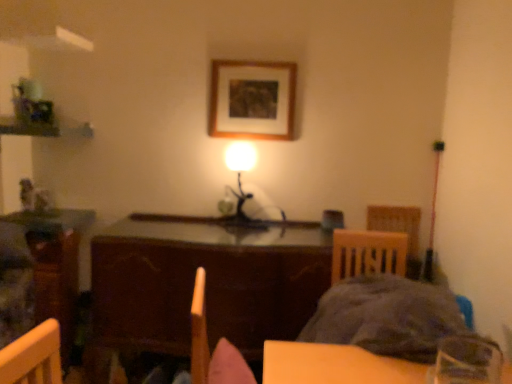
What do you see at coordinates (53, 262) in the screenshot? I see `wooden table at left, which is counted as the first table, starting from the left` at bounding box center [53, 262].

This screenshot has width=512, height=384. In order to click on wooden table at left, which is counted as the first table, starting from the left in this screenshot , I will do `click(53, 262)`.

You are a GUI agent. You are given a task and a screenshot of the screen. Output one action in this format:
    pyautogui.click(x=<x>, y=<y>)
    Task: Click on the metallic silver table lamp at center
    
    Given the screenshot: What is the action you would take?
    tap(240, 181)

What do you see at coordinates (386, 317) in the screenshot? I see `fluffy gray blanket at lower right` at bounding box center [386, 317].

Consider the image. What is the approximate width of fluffy gray blanket at lower right?

The width of fluffy gray blanket at lower right is 19.36 inches.

The image size is (512, 384). Find the location of `wooden table at left, which is counted as the first table, starting from the left`. wooden table at left, which is counted as the first table, starting from the left is located at coordinates (53, 262).

Is metallic silver table lamp at center surrounded by fluffy gray blanket at lower right?

No, metallic silver table lamp at center is not surrounded by fluffy gray blanket at lower right.

Who is shorter, fluffy gray blanket at lower right or metallic silver table lamp at center?

With less height is fluffy gray blanket at lower right.

Considering the sizes of fluffy gray blanket at lower right and metallic silver table lamp at center in the image, is fluffy gray blanket at lower right wider or thinner than metallic silver table lamp at center?

Clearly, fluffy gray blanket at lower right has more width compared to metallic silver table lamp at center.

Would you say fluffy gray blanket at lower right is to the left or to the right of metallic silver table lamp at center in the picture?

From the image, it's evident that fluffy gray blanket at lower right is to the right of metallic silver table lamp at center.

Between point (342, 228) and point (388, 326), which one is positioned in front?

Positioned in front is point (388, 326).

Consider the image. Is matte brown armchair at center facing towards fluffy gray blanket at lower right?

Yes, matte brown armchair at center is aimed at fluffy gray blanket at lower right.

Considering the relative positions of matte brown armchair at center and fluffy gray blanket at lower right in the image provided, is matte brown armchair at center to the right of fluffy gray blanket at lower right from the viewer's perspective?

In fact, matte brown armchair at center is to the left of fluffy gray blanket at lower right.

Does matte brown armchair at center have a larger size compared to fluffy gray blanket at lower right?

Actually, matte brown armchair at center might be smaller than fluffy gray blanket at lower right.

Consider the image. Could you tell me if metallic silver table lamp at center is facing wooden picture frame at upper center?

No, metallic silver table lamp at center is not aimed at wooden picture frame at upper center.

Considering the positions of point (254, 222) and point (277, 129), is point (254, 222) closer or farther from the camera than point (277, 129)?

Point (254, 222) is positioned farther from the camera compared to point (277, 129).

From a real-world perspective, between metallic silver table lamp at center and wooden picture frame at upper center, who is vertically lower?

metallic silver table lamp at center, from a real-world perspective.

Which object is thinner, metallic silver table lamp at center or wooden picture frame at upper center?

wooden picture frame at upper center is thinner.

Is metallic silver table lamp at center positioned before matte brown armchair at center?

Yes.

Can you confirm if metallic silver table lamp at center is taller than matte brown armchair at center?

Indeed, metallic silver table lamp at center has a greater height compared to matte brown armchair at center.

Is point (239, 143) in front of point (324, 212)?

That is True.

Is fluffy gray blanket at lower right positioned beyond the bounds of matte brown armchair at center?

fluffy gray blanket at lower right lies outside matte brown armchair at center's area.

From the image's perspective, which one is positioned higher, fluffy gray blanket at lower right or matte brown armchair at center?

From the image's view, matte brown armchair at center is above.

Considering the relative sizes of fluffy gray blanket at lower right and matte brown armchair at center in the image provided, is fluffy gray blanket at lower right shorter than matte brown armchair at center?

No.

Looking at this image, are fluffy gray blanket at lower right and matte brown armchair at center far apart?

No.

Looking at this image, how much distance is there between wooden picture frame at upper center and wooden table at center, which appears as the 2th table when viewed from the left?

They are 92.85 centimeters apart.

Choose the correct answer: Is wooden picture frame at upper center inside wooden table at center, which appears as the 2th table when viewed from the left, or outside it?

wooden picture frame at upper center is spatially situated outside wooden table at center, which appears as the 2th table when viewed from the left.

Could you tell me if wooden picture frame at upper center is turned towards wooden table at center, which is the first table from right to left?

No, wooden picture frame at upper center is not aimed at wooden table at center, which is the first table from right to left.

Is wooden picture frame at upper center thinner than wooden table at center, which is the first table from right to left?

Yes.

Does point (215, 332) come behind point (65, 356)?

No.

Is wooden table at center, which is the first table from right to left, looking in the opposite direction of wooden table at left, the second table viewed from the right?

No, wooden table at center, which is the first table from right to left, is not facing the opposite direction of wooden table at left, the second table viewed from the right.

From the picture: How much distance is there between wooden table at center, which appears as the 2th table when viewed from the left, and wooden table at left, the second table viewed from the right?

wooden table at center, which appears as the 2th table when viewed from the left, is 67.67 centimeters away from wooden table at left, the second table viewed from the right.

Find the location of a particular element. The height and width of the screenshot is (384, 512). bedding in front of the metallic silver table lamp at center is located at coordinates (386, 317).

At what (x,y) coordinates should I click in order to perform the action: click on armchair above the fluffy gray blanket at lower right (from a real-world perspective). Please return your answer as a coordinate pair (x, y). This screenshot has width=512, height=384. Looking at the image, I should click on (332, 220).

Based on their spatial positions, is wooden table at center, which appears as the 2th table when viewed from the left, or wooden picture frame at upper center further from fluffy gray blanket at lower right?

wooden picture frame at upper center lies further to fluffy gray blanket at lower right than the other object.

Considering their positions, is wooden table at left, the second table viewed from the right, positioned further to wooden table at center, which is the first table from right to left, than wooden picture frame at upper center?

wooden picture frame at upper center.

Based on their spatial positions, is wooden table at left, the second table viewed from the right, or fluffy gray blanket at lower right closer to wooden table at center, which appears as the 2th table when viewed from the left?

Among the two, fluffy gray blanket at lower right is located nearer to wooden table at center, which appears as the 2th table when viewed from the left.

Estimate the real-world distances between objects in this image. Which object is closer to wooden table at center, which is the first table from right to left, fluffy gray blanket at lower right or wooden picture frame at upper center?

The object closer to wooden table at center, which is the first table from right to left, is fluffy gray blanket at lower right.

Based on their spatial positions, is fluffy gray blanket at lower right or wooden table at center, which appears as the 2th table when viewed from the left, further from wooden table at left, the second table viewed from the right?

fluffy gray blanket at lower right is further to wooden table at left, the second table viewed from the right.

Looking at the image, which one is located closer to fluffy gray blanket at lower right, wooden table at left, which is counted as the first table, starting from the left, or wooden picture frame at upper center?

Based on the image, wooden picture frame at upper center appears to be nearer to fluffy gray blanket at lower right.

From the image, which object appears to be farther from fluffy gray blanket at lower right, matte brown armchair at center or wooden table at center, which is the first table from right to left?

matte brown armchair at center.

Looking at the image, which one is located further to matte brown armchair at center, wooden table at left, which is counted as the first table, starting from the left, or metallic silver table lamp at center?

wooden table at left, which is counted as the first table, starting from the left, lies further to matte brown armchair at center than the other object.

Locate an element on the screen. armchair between wooden picture frame at upper center and wooden table at center, which is the first table from right to left, from top to bottom is located at coordinates (332, 220).

Locate an element on the screen. This screenshot has width=512, height=384. table situated between wooden table at left, which is counted as the first table, starting from the left, and wooden picture frame at upper center from left to right is located at coordinates (206, 283).

I want to click on table situated between wooden table at left, the second table viewed from the right, and fluffy gray blanket at lower right from left to right, so click(x=206, y=283).

Where is `table between fluffy gray blanket at lower right and metallic silver table lamp at center from front to back`? The image size is (512, 384). table between fluffy gray blanket at lower right and metallic silver table lamp at center from front to back is located at coordinates (206, 283).